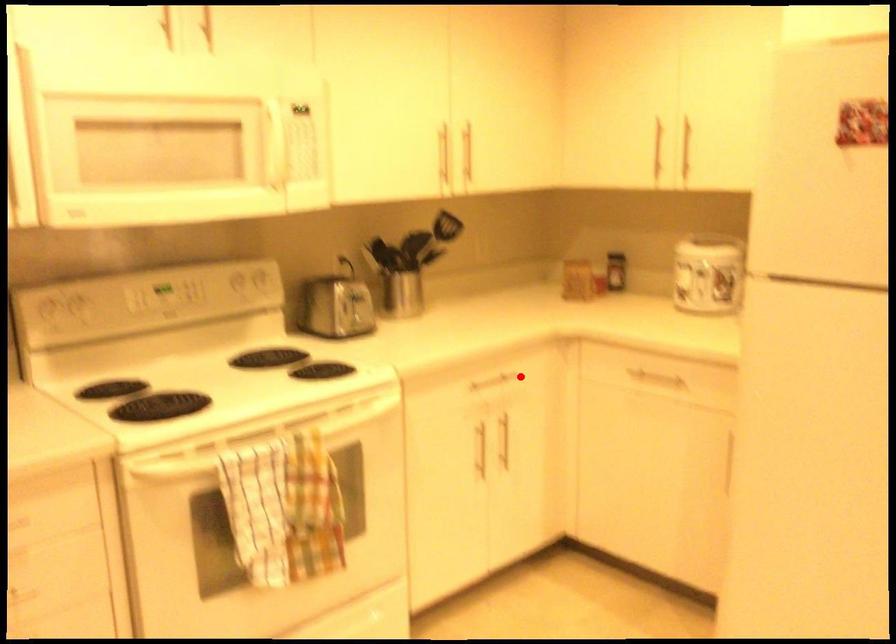
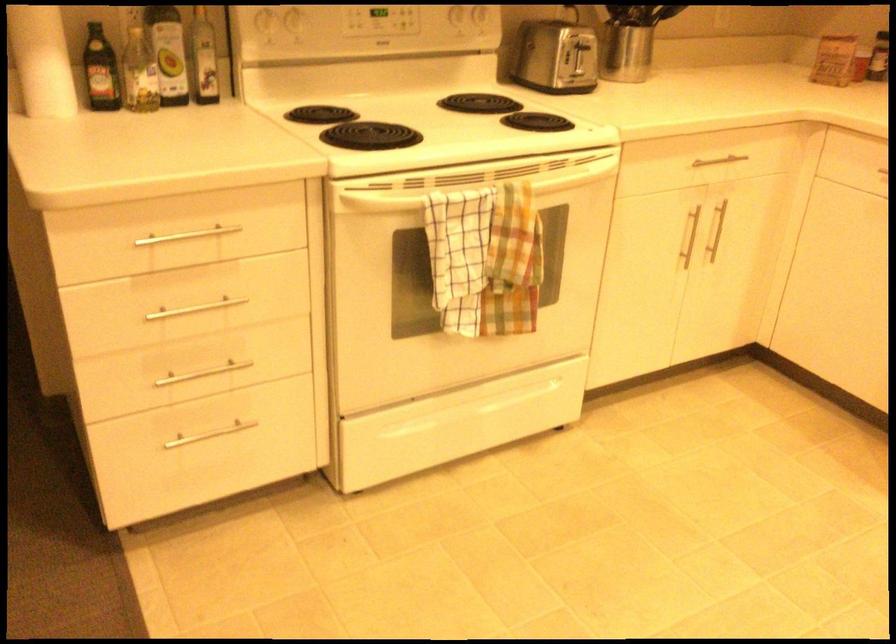
Find the pixel in the second image that matches the highlighted location in the first image.

(745, 164)